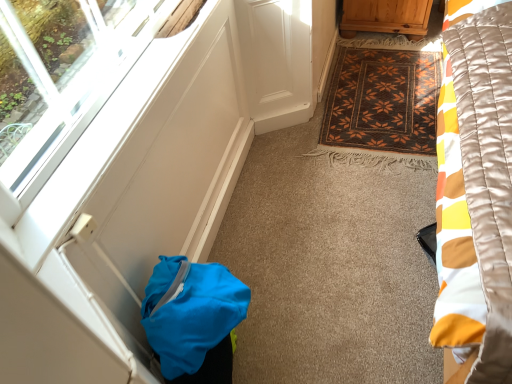
The image size is (512, 384). What are the coordinates of `wooden cabinet at upper right` in the screenshot? It's located at (386, 17).

Where is `transparent glass window at lower left`? Image resolution: width=512 pixels, height=384 pixels. transparent glass window at lower left is located at coordinates (68, 100).

Identify the location of brown woven mat at center. The image size is (512, 384). (382, 106).

The width and height of the screenshot is (512, 384). In order to click on blue fabric bag at lower left in this screenshot , I will do `click(193, 319)`.

From the image's perspective, which one is positioned higher, wooden cabinet at upper right or blue fabric bag at lower left?

wooden cabinet at upper right, from the image's perspective.

Is wooden cabinet at upper right next to blue fabric bag at lower left?

No, wooden cabinet at upper right is not beside blue fabric bag at lower left.

Between point (382, 25) and point (211, 326), which one is positioned behind?

Point (382, 25)

Could you tell me if wooden cabinet at upper right is turned towards blue fabric bag at lower left?

Yes, wooden cabinet at upper right is facing blue fabric bag at lower left.

From the image's perspective, which one is positioned lower, brown woven mat at center or wooden cabinet at upper right?

brown woven mat at center, from the image's perspective.

In the scene shown: Are brown woven mat at center and wooden cabinet at upper right far apart?

No, brown woven mat at center is not far away from wooden cabinet at upper right.

Does brown woven mat at center have a smaller size compared to wooden cabinet at upper right?

Indeed, brown woven mat at center has a smaller size compared to wooden cabinet at upper right.

Is brown woven mat at center facing away from wooden cabinet at upper right?

brown woven mat at center is not turned away from wooden cabinet at upper right.

From the image's perspective, is blue fabric bag at lower left positioned above or below brown woven mat at center?

Clearly, from the image's perspective, blue fabric bag at lower left is below brown woven mat at center.

Which is more to the left, blue fabric bag at lower left or brown woven mat at center?

From the viewer's perspective, blue fabric bag at lower left appears more on the left side.

In order to click on mat beneath the blue fabric bag at lower left (from a real-world perspective) in this screenshot , I will do `click(382, 106)`.

Considering the sizes of blue fabric bag at lower left and brown woven mat at center in the image, is blue fabric bag at lower left taller or shorter than brown woven mat at center?

Clearly, blue fabric bag at lower left is taller compared to brown woven mat at center.

Between transparent glass window at lower left and brown woven mat at center, which one appears on the left side from the viewer's perspective?

transparent glass window at lower left.

Is the position of transparent glass window at lower left more distant than that of brown woven mat at center?

No, transparent glass window at lower left is in front of brown woven mat at center.

The height and width of the screenshot is (384, 512). What are the coordinates of `mat that appears above the transparent glass window at lower left (from the image's perspective)` in the screenshot? It's located at (382, 106).

Is brown woven mat at center surrounded by transparent glass window at lower left?

No, transparent glass window at lower left does not contain brown woven mat at center.

Could you tell me if blue fabric bag at lower left is turned towards wooden cabinet at upper right?

No.

Considering the sizes of blue fabric bag at lower left and wooden cabinet at upper right in the image, is blue fabric bag at lower left wider or thinner than wooden cabinet at upper right?

Considering their sizes, blue fabric bag at lower left looks slimmer than wooden cabinet at upper right.

How distant is blue fabric bag at lower left from wooden cabinet at upper right?

1.71 meters.

Who is smaller, blue fabric bag at lower left or wooden cabinet at upper right?

blue fabric bag at lower left.

From the image's perspective, does brown woven mat at center appear lower than blue fabric bag at lower left?

Incorrect, from the image's perspective, brown woven mat at center is higher than blue fabric bag at lower left.

In the image, is brown woven mat at center positioned in front of or behind blue fabric bag at lower left?

brown woven mat at center is behind blue fabric bag at lower left.

Is brown woven mat at center facing away from blue fabric bag at lower left?

No, brown woven mat at center is not facing the opposite direction of blue fabric bag at lower left.

Is transparent glass window at lower left far from blue fabric bag at lower left?

No.

Looking at their sizes, would you say transparent glass window at lower left is wider or thinner than blue fabric bag at lower left?

In the image, transparent glass window at lower left appears to be more narrow than blue fabric bag at lower left.

From the picture: Considering the relative positions of transparent glass window at lower left and blue fabric bag at lower left in the image provided, is transparent glass window at lower left behind blue fabric bag at lower left?

No, the depth of transparent glass window at lower left is less than that of blue fabric bag at lower left.

The width and height of the screenshot is (512, 384). Find the location of `furniture lying on the right of blue fabric bag at lower left`. furniture lying on the right of blue fabric bag at lower left is located at coordinates coord(386,17).

Find the location of a particular element. The width and height of the screenshot is (512, 384). furniture above the brown woven mat at center (from the image's perspective) is located at coordinates (386, 17).

Based on their spatial positions, is blue fabric bag at lower left or transparent glass window at lower left closer to wooden cabinet at upper right?

transparent glass window at lower left is closer to wooden cabinet at upper right.

Considering their positions, is blue fabric bag at lower left positioned closer to transparent glass window at lower left than brown woven mat at center?

Based on the image, blue fabric bag at lower left appears to be nearer to transparent glass window at lower left.

From the image, which object appears to be nearer to wooden cabinet at upper right, brown woven mat at center or transparent glass window at lower left?

Based on the image, brown woven mat at center appears to be nearer to wooden cabinet at upper right.

In the scene shown: Which object lies nearer to the anchor point brown woven mat at center, transparent glass window at lower left or wooden cabinet at upper right?

The object closer to brown woven mat at center is wooden cabinet at upper right.

Based on their spatial positions, is wooden cabinet at upper right or brown woven mat at center further from transparent glass window at lower left?

Among the two, wooden cabinet at upper right is located further to transparent glass window at lower left.

Looking at the image, which one is located further to brown woven mat at center, transparent glass window at lower left or blue fabric bag at lower left?

Among the two, blue fabric bag at lower left is located further to brown woven mat at center.

Which object lies further to the anchor point transparent glass window at lower left, blue fabric bag at lower left or wooden cabinet at upper right?

wooden cabinet at upper right is positioned further to the anchor transparent glass window at lower left.

Looking at the image, which one is located further to brown woven mat at center, wooden cabinet at upper right or blue fabric bag at lower left?

Based on the image, blue fabric bag at lower left appears to be further to brown woven mat at center.

Identify the location of window between wooden cabinet at upper right and blue fabric bag at lower left vertically. The width and height of the screenshot is (512, 384). (68, 100).

You are a GUI agent. You are given a task and a screenshot of the screen. Output one action in this format:
    pyautogui.click(x=<x>, y=<y>)
    Task: Click on the bag located between transparent glass window at lower left and brown woven mat at center in the depth direction
    
    Given the screenshot: What is the action you would take?
    pyautogui.click(x=193, y=319)

Identify the location of mat positioned between transparent glass window at lower left and wooden cabinet at upper right from near to far. The width and height of the screenshot is (512, 384). (382, 106).

You are a GUI agent. You are given a task and a screenshot of the screen. Output one action in this format:
    pyautogui.click(x=<x>, y=<y>)
    Task: Click on the mat between wooden cabinet at upper right and blue fabric bag at lower left in the up-down direction
    Image resolution: width=512 pixels, height=384 pixels.
    Given the screenshot: What is the action you would take?
    pyautogui.click(x=382, y=106)